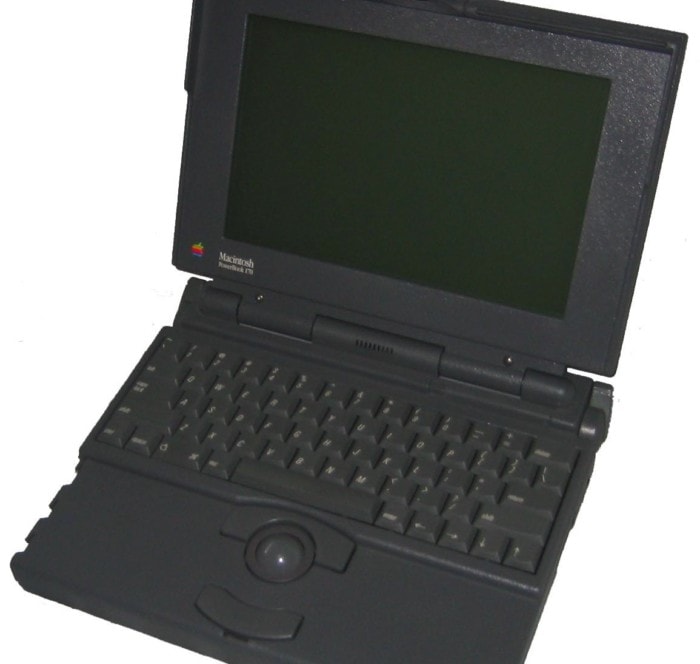
Identify the location of monitor. Image resolution: width=700 pixels, height=664 pixels. (397, 155).